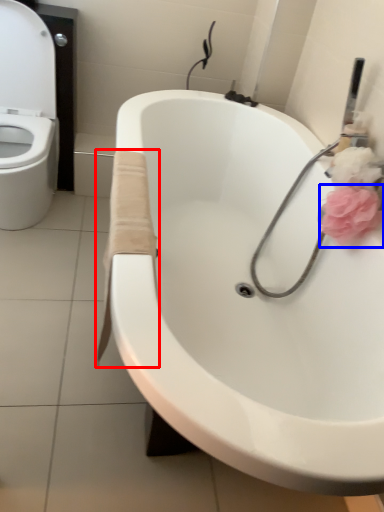
Question: Which point is closer to the camera, material (highlighted by a red box) or flower (highlighted by a blue box)?

Choices:
 (A) material
 (B) flower

Answer: (A)